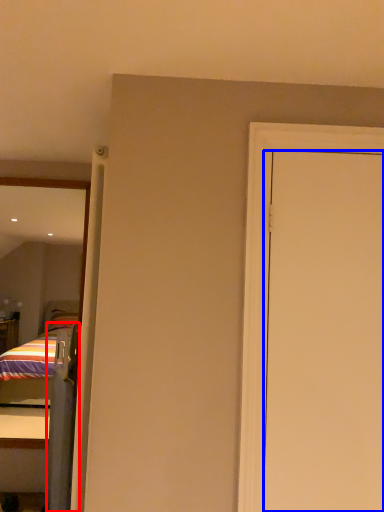
Question: Which of the following is the farthest to the observer, screen door (highlighted by a red box) or door (highlighted by a blue box)?

Choices:
 (A) screen door
 (B) door

Answer: (A)